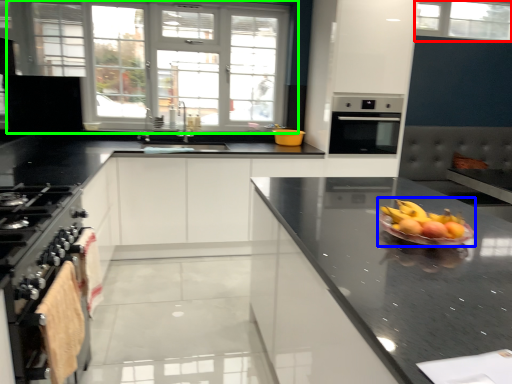
Question: Which object is positioned closest to window (highlighted by a red box)? Select from fruit salad (highlighted by a blue box) and window (highlighted by a green box).

Choices:
 (A) fruit salad
 (B) window

Answer: (B)